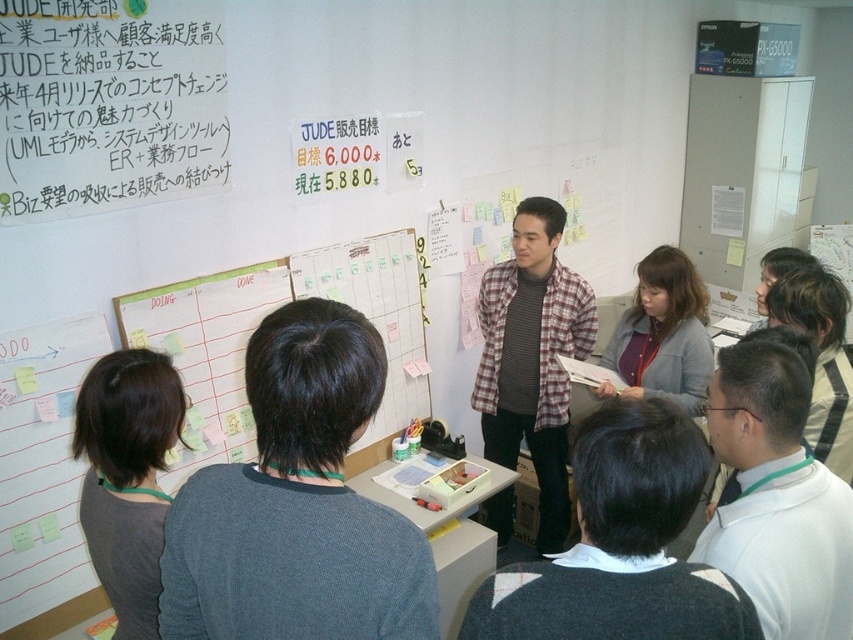
This screenshot has width=853, height=640. What do you see at coordinates (297, 502) in the screenshot?
I see `dark gray sweater at center` at bounding box center [297, 502].

Does dark gray sweater at center appear on the right side of gray sweater at center?

In fact, dark gray sweater at center is to the left of gray sweater at center.

Does point (296, 538) lie in front of point (675, 308)?

That is True.

Identify the location of dark gray sweater at center. 297,502.

Which of these two, matte white paper at upper left or gray sweater at center, stands shorter?

gray sweater at center

Is point (93, 109) positioned in front of point (631, 336)?

Yes, it is in front of point (631, 336).

Locate an element on the screen. This screenshot has width=853, height=640. matte white paper at upper left is located at coordinates (109, 104).

Is plaid fabric shirt at center to the right of gray sweater at center from the viewer's perspective?

In fact, plaid fabric shirt at center is to the left of gray sweater at center.

Which is behind, point (552, 508) or point (643, 358)?

Positioned behind is point (552, 508).

Identify the location of plaid fabric shirt at center. This screenshot has width=853, height=640. (532, 356).

Image resolution: width=853 pixels, height=640 pixels. I want to click on plaid fabric shirt at center, so pyautogui.click(x=532, y=356).